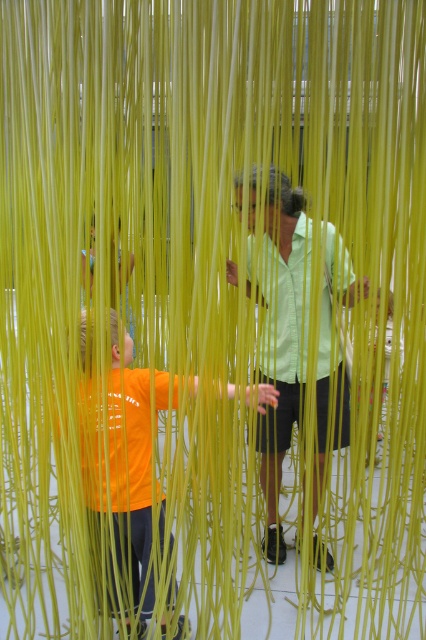
Does orange matte shirt at center have a smaller size compared to green textured shirt at center?

No.

Does orange matte shirt at center lie behind green textured shirt at center?

That is False.

Image resolution: width=426 pixels, height=640 pixels. What are the coordinates of `orange matte shirt at center` in the screenshot? It's located at (120, 448).

What do you see at coordinates (282, 336) in the screenshot? This screenshot has height=640, width=426. I see `light green shirt at center` at bounding box center [282, 336].

Can you confirm if light green shirt at center is wider than orange matte shirt at center?

Incorrect, light green shirt at center's width does not surpass orange matte shirt at center's.

Between point (268, 205) and point (109, 440), which one is positioned behind?

The point (268, 205) is more distant.

At what (x,y) coordinates should I click in order to perform the action: click on light green shirt at center. Please return your answer as a coordinate pair (x, y). Looking at the image, I should click on (282, 336).

Between light green shirt at center and green textured shirt at center, which one has more height?

light green shirt at center is taller.

Locate an element on the screen. This screenshot has width=426, height=640. light green shirt at center is located at coordinates (282, 336).